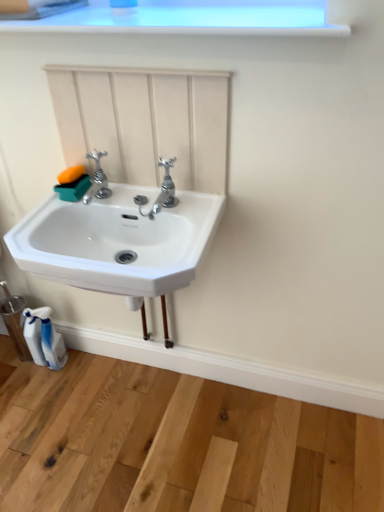
Locate an element on the screen. polished chrome faucet at center, the first tap positioned from the right is located at coordinates (161, 191).

What do you see at coordinates (44, 338) in the screenshot? The height and width of the screenshot is (512, 384). I see `white plastic spray bottle at lower left` at bounding box center [44, 338].

The image size is (384, 512). What do you see at coordinates (119, 238) in the screenshot? I see `white ceramic sink at center` at bounding box center [119, 238].

You are a GUI agent. You are given a task and a screenshot of the screen. Output one action in this format:
    pyautogui.click(x=<x>, y=<y>)
    Task: Click on the polished chrome faucet at center, the first tap positioned from the right
    Image resolution: width=384 pixels, height=512 pixels.
    Given the screenshot: What is the action you would take?
    pyautogui.click(x=161, y=191)

Between polished chrome faucet at center, which appears as the 2th tap when viewed from the left, and white plastic spray bottle at lower left, which one has smaller width?

white plastic spray bottle at lower left.

In the scene shown: Are polished chrome faucet at center, the first tap positioned from the right, and white plastic spray bottle at lower left far apart?

They are positioned close to each other.

From the image's perspective, is polished chrome faucet at center, which appears as the 2th tap when viewed from the left, above white plastic spray bottle at lower left?

Yes, from the image's perspective, polished chrome faucet at center, which appears as the 2th tap when viewed from the left, is above white plastic spray bottle at lower left.

Is polished chrome faucet at center, the first tap positioned from the right, inside the boundaries of white plastic spray bottle at lower left, or outside?

polished chrome faucet at center, the first tap positioned from the right, lies outside white plastic spray bottle at lower left.

Which is further, (113, 215) or (155, 6)?

The point (113, 215) is farther.

Consider the image. Who is smaller, white ceramic sink at center or white plastic window frame at upper center?

With smaller size is white plastic window frame at upper center.

From the image's perspective, is white ceramic sink at center located above white plastic window frame at upper center?

No, from the image's perspective, white ceramic sink at center is not on top of white plastic window frame at upper center.

Is white ceramic sink at center wider than white plastic spray bottle at lower left?

Yes, white ceramic sink at center is wider than white plastic spray bottle at lower left.

From the image's perspective, relative to white plastic spray bottle at lower left, is white ceramic sink at center above or below?

Clearly, from the image's perspective, white ceramic sink at center is above white plastic spray bottle at lower left.

Is white ceramic sink at center behind white plastic spray bottle at lower left?

No.

In the scene shown: From a real-world perspective, which object stands above the other?

polished chrome tap at center, placed as the 2th tap when sorted from right to left.

Is white ceramic sink at center turned away from polished chrome tap at center, the 1th tap viewed from the left?

No.

Between white ceramic sink at center and polished chrome tap at center, the 1th tap viewed from the left, which one is positioned behind?

polished chrome tap at center, the 1th tap viewed from the left, is more distant.

Which object is positioned more to the left, white ceramic sink at center or polished chrome tap at center, the 1th tap viewed from the left?

Positioned to the left is polished chrome tap at center, the 1th tap viewed from the left.

Is white plastic spray bottle at lower left not inside white ceramic sink at center?

That's correct, white plastic spray bottle at lower left is outside of white ceramic sink at center.

From a real-world perspective, does white plastic spray bottle at lower left stand above white ceramic sink at center?

No, from a real-world perspective, white plastic spray bottle at lower left is not over white ceramic sink at center

Can you see white plastic spray bottle at lower left touching white ceramic sink at center?

white plastic spray bottle at lower left and white ceramic sink at center are not in contact.

I want to click on sink located on the right of white plastic spray bottle at lower left, so click(119, 238).

Identify the location of cleaning product below the polished chrome tap at center, placed as the 2th tap when sorted from right to left (from a real-world perspective). (x=44, y=338).

Could you tell me if polished chrome tap at center, the 1th tap viewed from the left, is turned towards white plastic spray bottle at lower left?

No, polished chrome tap at center, the 1th tap viewed from the left, is not aimed at white plastic spray bottle at lower left.

Considering the relative sizes of polished chrome tap at center, the 1th tap viewed from the left, and white plastic spray bottle at lower left in the image provided, is polished chrome tap at center, the 1th tap viewed from the left, wider than white plastic spray bottle at lower left?

Yes, polished chrome tap at center, the 1th tap viewed from the left, is wider than white plastic spray bottle at lower left.

Looking at the image, does polished chrome tap at center, placed as the 2th tap when sorted from right to left, seem bigger or smaller compared to white plastic spray bottle at lower left?

Considering their sizes, polished chrome tap at center, placed as the 2th tap when sorted from right to left, takes up less space than white plastic spray bottle at lower left.

Can you confirm if polished chrome faucet at center, which appears as the 2th tap when viewed from the left, is thinner than white plastic window frame at upper center?

Indeed, polished chrome faucet at center, which appears as the 2th tap when viewed from the left, has a lesser width compared to white plastic window frame at upper center.

Is polished chrome faucet at center, the first tap positioned from the right, bigger than white plastic window frame at upper center?

No, polished chrome faucet at center, the first tap positioned from the right, is not bigger than white plastic window frame at upper center.

Based on the photo, from the image's perspective, is polished chrome faucet at center, which appears as the 2th tap when viewed from the left, below white plastic window frame at upper center?

Correct, polished chrome faucet at center, which appears as the 2th tap when viewed from the left, appears lower than white plastic window frame at upper center in the image.

Is point (172, 184) positioned before point (269, 9)?

That is False.

The width and height of the screenshot is (384, 512). I want to click on the 1st tap above the white plastic spray bottle at lower left (from the image's perspective), so click(161, 191).

Where is `window frame located on the right of white ceramic sink at center`? This screenshot has width=384, height=512. window frame located on the right of white ceramic sink at center is located at coordinates (186, 18).

Looking at this image, based on their spatial positions, is polished chrome faucet at center, the first tap positioned from the right, or white plastic window frame at upper center further from white ceramic sink at center?

white plastic window frame at upper center is positioned further to the anchor white ceramic sink at center.

Looking at the image, which one is located closer to white plastic window frame at upper center, polished chrome tap at center, placed as the 2th tap when sorted from right to left, or white ceramic sink at center?

polished chrome tap at center, placed as the 2th tap when sorted from right to left.

Considering their positions, is white ceramic sink at center positioned closer to polished chrome tap at center, placed as the 2th tap when sorted from right to left, than white plastic spray bottle at lower left?

white ceramic sink at center is closer to polished chrome tap at center, placed as the 2th tap when sorted from right to left.

In the scene shown: Based on their spatial positions, is white ceramic sink at center or white plastic window frame at upper center closer to polished chrome tap at center, placed as the 2th tap when sorted from right to left?

The object closer to polished chrome tap at center, placed as the 2th tap when sorted from right to left, is white ceramic sink at center.

Looking at the image, which one is located further to white ceramic sink at center, polished chrome tap at center, the 1th tap viewed from the left, or white plastic window frame at upper center?

The object further to white ceramic sink at center is white plastic window frame at upper center.

Based on their spatial positions, is polished chrome faucet at center, the first tap positioned from the right, or white plastic window frame at upper center closer to polished chrome tap at center, placed as the 2th tap when sorted from right to left?

The object closer to polished chrome tap at center, placed as the 2th tap when sorted from right to left, is polished chrome faucet at center, the first tap positioned from the right.

When comparing their distances from polished chrome faucet at center, which appears as the 2th tap when viewed from the left, does white plastic spray bottle at lower left or white ceramic sink at center seem further?

white plastic spray bottle at lower left.

When comparing their distances from polished chrome tap at center, the 1th tap viewed from the left, does white plastic spray bottle at lower left or polished chrome faucet at center, the first tap positioned from the right, seem further?

white plastic spray bottle at lower left is further to polished chrome tap at center, the 1th tap viewed from the left.

Find the location of a particular element. sink between white plastic window frame at upper center and white plastic spray bottle at lower left in the vertical direction is located at coordinates (119, 238).

You are a GUI agent. You are given a task and a screenshot of the screen. Output one action in this format:
    pyautogui.click(x=<x>, y=<y>)
    Task: Click on the tap between white ceramic sink at center and polished chrome tap at center, the 1th tap viewed from the left, along the z-axis
    The height and width of the screenshot is (512, 384).
    Given the screenshot: What is the action you would take?
    (161, 191)

Where is `tap between polished chrome tap at center, placed as the 2th tap when sorted from right to left, and white plastic spray bottle at lower left from top to bottom`? This screenshot has height=512, width=384. tap between polished chrome tap at center, placed as the 2th tap when sorted from right to left, and white plastic spray bottle at lower left from top to bottom is located at coordinates (161, 191).

Locate an element on the screen. This screenshot has width=384, height=512. tap that lies between white plastic window frame at upper center and polished chrome faucet at center, which appears as the 2th tap when viewed from the left, from top to bottom is located at coordinates (97, 180).